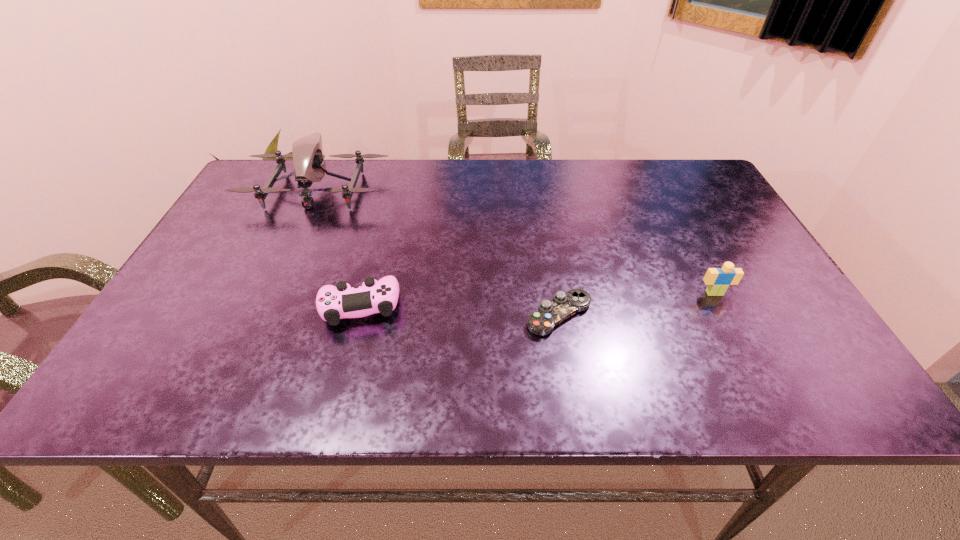
Find the location of a particular element. free space at the far left corner is located at coordinates tap(276, 166).

The image size is (960, 540). I want to click on vacant area at the near left corner, so click(196, 373).

Identify the location of vacant space at the far right corner of the desktop. Image resolution: width=960 pixels, height=540 pixels. (680, 180).

At what (x,y) coordinates should I click in order to perform the action: click on free space at the near right corner of the desktop. Please return your answer as a coordinate pair (x, y). The image size is (960, 540). Looking at the image, I should click on (777, 387).

Find the location of `free space between the taller control and the shorter control`. free space between the taller control and the shorter control is located at coordinates (460, 310).

Locate an element on the screen. free space between the third tallest object and the second tallest object is located at coordinates (538, 300).

Where is `blank region between the taller control and the Lego`? The height and width of the screenshot is (540, 960). blank region between the taller control and the Lego is located at coordinates (538, 300).

Image resolution: width=960 pixels, height=540 pixels. Find the location of `free spot between the shortest object and the second shortest object`. free spot between the shortest object and the second shortest object is located at coordinates click(460, 310).

The width and height of the screenshot is (960, 540). In order to click on vacant space that is in between the rightmost object and the right control in this screenshot , I will do `click(636, 304)`.

Image resolution: width=960 pixels, height=540 pixels. Identify the location of free spot between the shortest object and the left control. (460, 310).